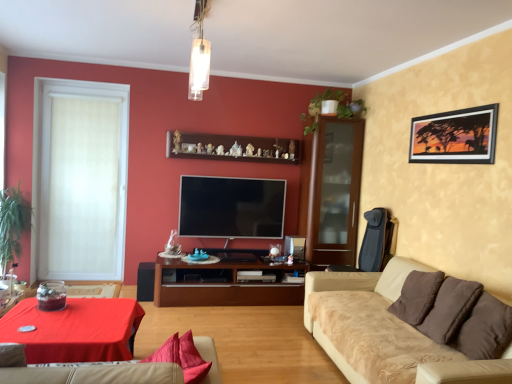
Question: Can you confirm if beige fabric couch at lower right, marked as the first studio couch in a right-to-left arrangement, is shorter than wooden shelf at upper center?

Choices:
 (A) yes
 (B) no

Answer: (B)

Question: Can you confirm if beige fabric couch at lower right, placed as the second studio couch when sorted from left to right, is bigger than wooden shelf at upper center?

Choices:
 (A) no
 (B) yes

Answer: (B)

Question: Is wooden shelf at upper center a part of beige fabric couch at lower right, placed as the second studio couch when sorted from left to right?

Choices:
 (A) no
 (B) yes

Answer: (A)

Question: Is the position of beige fabric couch at lower right, placed as the second studio couch when sorted from left to right, less distant than that of wooden shelf at upper center?

Choices:
 (A) yes
 (B) no

Answer: (A)

Question: Is beige fabric couch at lower right, marked as the first studio couch in a right-to-left arrangement, positioned behind wooden shelf at upper center?

Choices:
 (A) yes
 (B) no

Answer: (B)

Question: Is silk matte painting at upper right situated inside green leafy plant at upper right, acting as the first plant starting from the top, or outside?

Choices:
 (A) inside
 (B) outside

Answer: (B)

Question: Considering the positions of silk matte painting at upper right and green leafy plant at upper right, the first plant viewed from the right, in the image, is silk matte painting at upper right bigger or smaller than green leafy plant at upper right, the first plant viewed from the right,?

Choices:
 (A) big
 (B) small

Answer: (B)

Question: Considering the positions of point (487, 112) and point (350, 112), is point (487, 112) closer or farther from the camera than point (350, 112)?

Choices:
 (A) farther
 (B) closer

Answer: (B)

Question: Considering the relative positions of silk matte painting at upper right and green leafy plant at upper right, the second plant positioned from the left, in the image provided, is silk matte painting at upper right to the left or to the right of green leafy plant at upper right, the second plant positioned from the left,?

Choices:
 (A) right
 (B) left

Answer: (A)

Question: Is flat screen tv at center taller or shorter than beige fabric couch at lower center, acting as the first studio couch starting from the left?

Choices:
 (A) tall
 (B) short

Answer: (A)

Question: Which is correct: flat screen tv at center is inside beige fabric couch at lower center, acting as the first studio couch starting from the left, or outside of it?

Choices:
 (A) inside
 (B) outside

Answer: (B)

Question: Does point (242, 228) appear closer or farther from the camera than point (215, 354)?

Choices:
 (A) farther
 (B) closer

Answer: (A)

Question: In terms of size, does flat screen tv at center appear bigger or smaller than beige fabric couch at lower center, placed as the 2th studio couch when sorted from right to left?

Choices:
 (A) big
 (B) small

Answer: (B)

Question: Looking at their shapes, would you say green leafy plant at left, placed as the 2th plant when sorted from right to left, is wider or thinner than matte black speaker at lower left?

Choices:
 (A) wide
 (B) thin

Answer: (A)

Question: Is point (19, 223) closer or farther from the camera than point (145, 291)?

Choices:
 (A) closer
 (B) farther

Answer: (B)